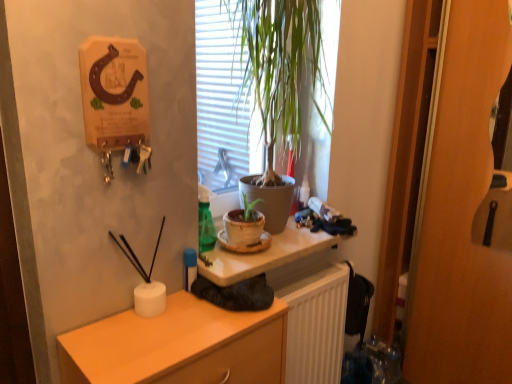
Question: Can we say matte orange cabinet at lower left lies outside matte white desk at center?

Choices:
 (A) no
 (B) yes

Answer: (B)

Question: Is the position of matte orange cabinet at lower left more distant than that of matte white desk at center?

Choices:
 (A) no
 (B) yes

Answer: (A)

Question: Does matte orange cabinet at lower left have a smaller size compared to matte white desk at center?

Choices:
 (A) yes
 (B) no

Answer: (B)

Question: Is matte orange cabinet at lower left taller than matte white desk at center?

Choices:
 (A) no
 (B) yes

Answer: (B)

Question: Is matte orange cabinet at lower left oriented away from matte white desk at center?

Choices:
 (A) yes
 (B) no

Answer: (B)

Question: Considering their positions, is matte white desk at center located in front of or behind white ribbed radiator at lower center?

Choices:
 (A) behind
 (B) front

Answer: (B)

Question: From the image's perspective, is matte white desk at center positioned above or below white ribbed radiator at lower center?

Choices:
 (A) above
 (B) below

Answer: (A)

Question: Is matte white desk at center taller or shorter than white ribbed radiator at lower center?

Choices:
 (A) short
 (B) tall

Answer: (A)

Question: Looking at their shapes, would you say matte white desk at center is wider or thinner than white ribbed radiator at lower center?

Choices:
 (A) wide
 (B) thin

Answer: (A)

Question: From a real-world perspective, is matte white desk at center positioned above or below matte orange cabinet at lower left?

Choices:
 (A) above
 (B) below

Answer: (A)

Question: In terms of size, does matte white desk at center appear bigger or smaller than matte orange cabinet at lower left?

Choices:
 (A) big
 (B) small

Answer: (B)

Question: Considering the positions of matte white desk at center and matte orange cabinet at lower left in the image, is matte white desk at center taller or shorter than matte orange cabinet at lower left?

Choices:
 (A) tall
 (B) short

Answer: (B)

Question: Based on their positions, is matte white desk at center located to the left or right of matte orange cabinet at lower left?

Choices:
 (A) left
 (B) right

Answer: (B)

Question: Visually, is matte orange cabinet at lower left positioned to the left or to the right of matte white desk at center?

Choices:
 (A) left
 (B) right

Answer: (A)

Question: From a real-world perspective, is matte orange cabinet at lower left physically located above or below matte white desk at center?

Choices:
 (A) below
 (B) above

Answer: (A)